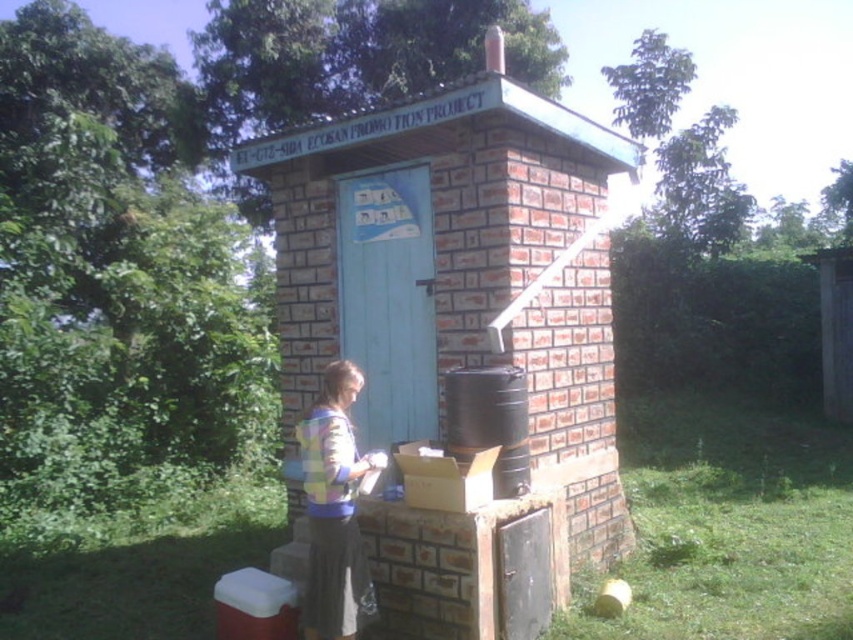
Question: Which object is closer to the camera taking this photo?

Choices:
 (A) brick/textured hut at center
 (B) multicolored knitted sweater at center

Answer: (B)

Question: Which object appears closest to the camera in this image?

Choices:
 (A) brick/textured hut at center
 (B) multicolored knitted sweater at center

Answer: (B)

Question: Does brick/textured hut at center have a greater width compared to multicolored knitted sweater at center?

Choices:
 (A) yes
 (B) no

Answer: (A)

Question: Can you confirm if brick/textured hut at center is positioned to the left of multicolored knitted sweater at center?

Choices:
 (A) yes
 (B) no

Answer: (B)

Question: Which of the following is the farthest from the observer?

Choices:
 (A) multicolored knitted sweater at center
 (B) brick/textured hut at center

Answer: (B)

Question: Is brick/textured hut at center further to camera compared to multicolored knitted sweater at center?

Choices:
 (A) no
 (B) yes

Answer: (B)